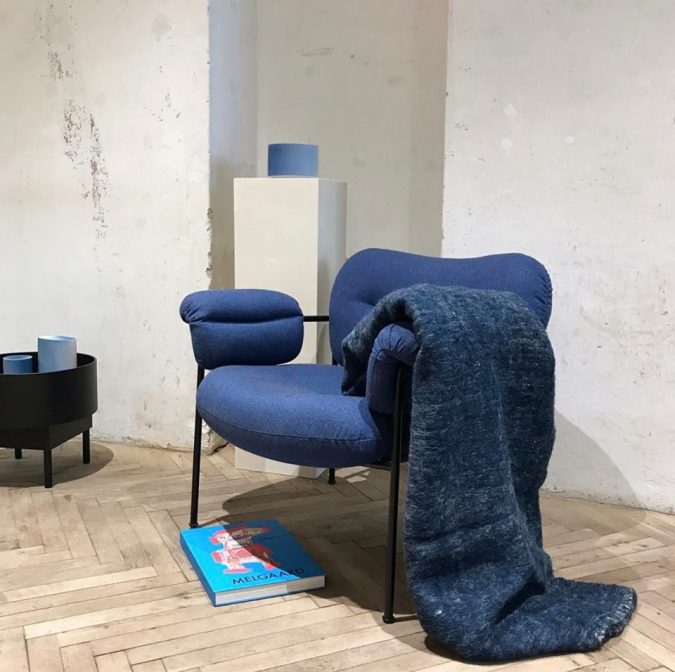
Image resolution: width=675 pixels, height=672 pixels. I want to click on table, so click(61, 416).